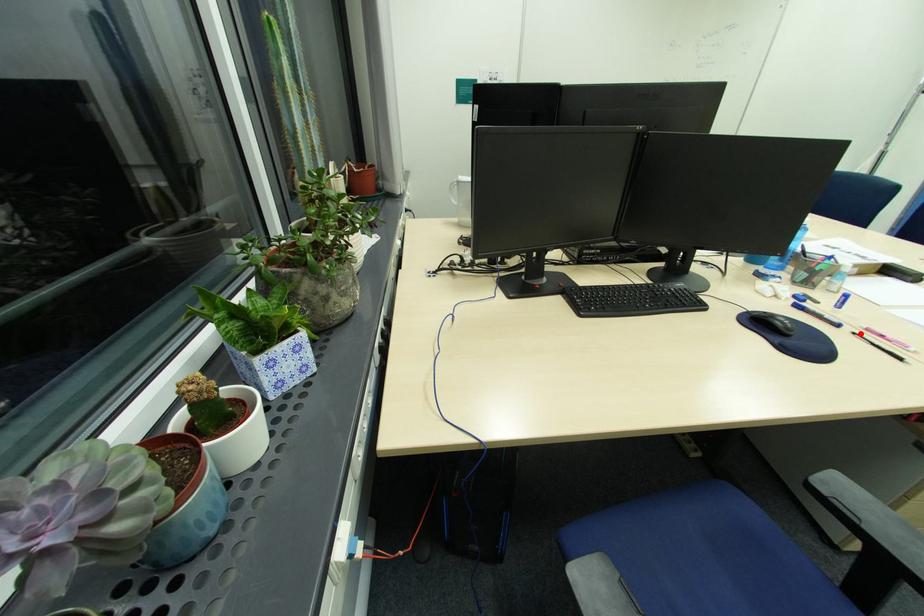
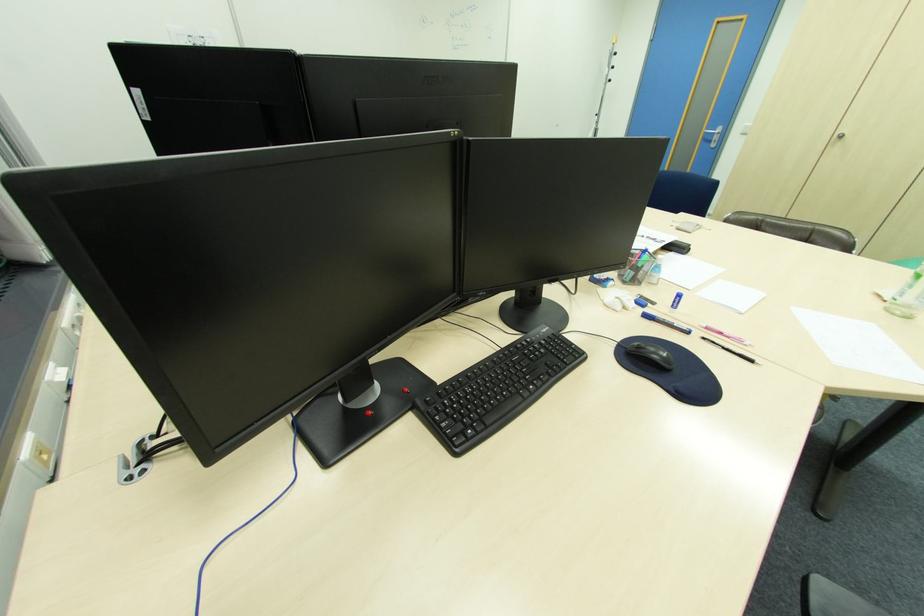
Locate, in the second image, the point that corresponds to the highlighted location in the first image.

(709, 339)